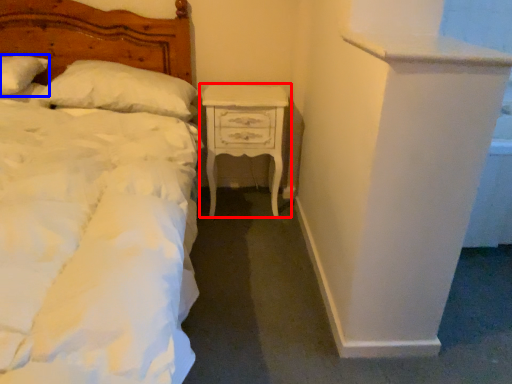
Question: Which of the following is the farthest to the observer, nightstand (highlighted by a red box) or pillow (highlighted by a blue box)?

Choices:
 (A) nightstand
 (B) pillow

Answer: (A)